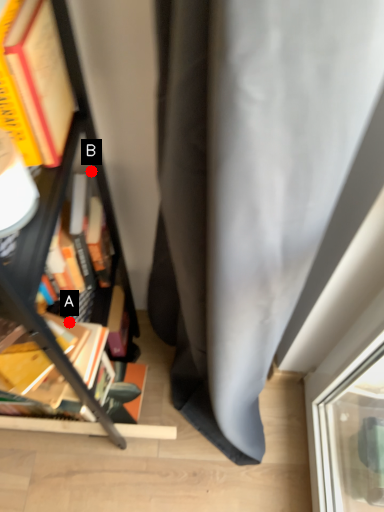
Question: Two points are circled on the image, labeled by A and B beside each circle. Which point is closer to the camera?

Choices:
 (A) A is closer
 (B) B is closer

Answer: (A)